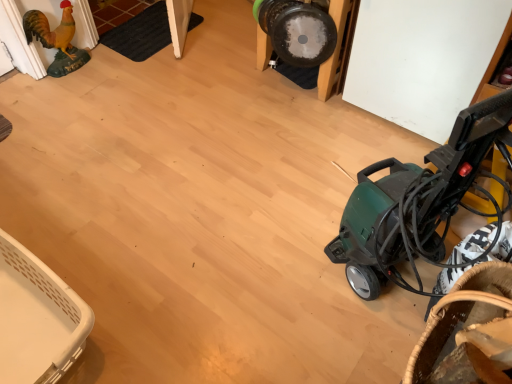
Question: Is green plastic vacuum cleaner at right thinner than white plastic basket at lower left, which is counted as the first basket, starting from the left?

Choices:
 (A) no
 (B) yes

Answer: (A)

Question: Is green plastic vacuum cleaner at right at the right side of white plastic basket at lower left, the second basket when ordered from right to left?

Choices:
 (A) yes
 (B) no

Answer: (A)

Question: Can you confirm if green plastic vacuum cleaner at right is taller than white plastic basket at lower left, the second basket when ordered from right to left?

Choices:
 (A) yes
 (B) no

Answer: (A)

Question: Is green plastic vacuum cleaner at right looking in the opposite direction of white plastic basket at lower left, the second basket when ordered from right to left?

Choices:
 (A) no
 (B) yes

Answer: (A)

Question: From the image's perspective, does green plastic vacuum cleaner at right appear higher than white plastic basket at lower left, the second basket in the front-to-back sequence?

Choices:
 (A) yes
 (B) no

Answer: (A)

Question: Would you say green plastic vacuum cleaner at right is to the left or to the right of golden matte chicken at left in the picture?

Choices:
 (A) left
 (B) right

Answer: (B)

Question: Considering the positions of green plastic vacuum cleaner at right and golden matte chicken at left in the image, is green plastic vacuum cleaner at right taller or shorter than golden matte chicken at left?

Choices:
 (A) tall
 (B) short

Answer: (A)

Question: From the image's perspective, is green plastic vacuum cleaner at right positioned above or below golden matte chicken at left?

Choices:
 (A) below
 (B) above

Answer: (A)

Question: Considering their positions, is green plastic vacuum cleaner at right located in front of or behind golden matte chicken at left?

Choices:
 (A) behind
 (B) front

Answer: (B)

Question: Is brown woven basket at lower right, positioned as the second basket in left-to-right order, to the left or to the right of green plastic vacuum cleaner at right in the image?

Choices:
 (A) right
 (B) left

Answer: (A)

Question: Is point (479, 286) positioned closer to the camera than point (394, 223)?

Choices:
 (A) closer
 (B) farther

Answer: (A)

Question: From the image's perspective, is brown woven basket at lower right, placed as the 1th basket when sorted from right to left, located above or below green plastic vacuum cleaner at right?

Choices:
 (A) above
 (B) below

Answer: (B)

Question: In the image, is brown woven basket at lower right, placed as the 1th basket when sorted from right to left, positioned in front of or behind green plastic vacuum cleaner at right?

Choices:
 (A) front
 (B) behind

Answer: (B)

Question: Is point (423, 215) closer or farther from the camera than point (472, 278)?

Choices:
 (A) closer
 (B) farther

Answer: (B)

Question: From their relative heights in the image, would you say green plastic vacuum cleaner at right is taller or shorter than brown woven basket at lower right, positioned as the second basket in left-to-right order?

Choices:
 (A) tall
 (B) short

Answer: (A)